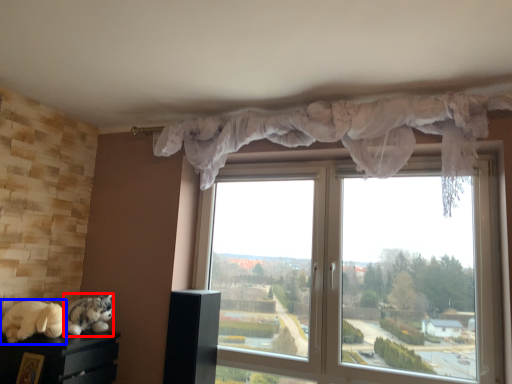
Question: Which object appears closest to the camera in this image, cat (highlighted by a red box) or animal (highlighted by a blue box)?

Choices:
 (A) cat
 (B) animal

Answer: (B)